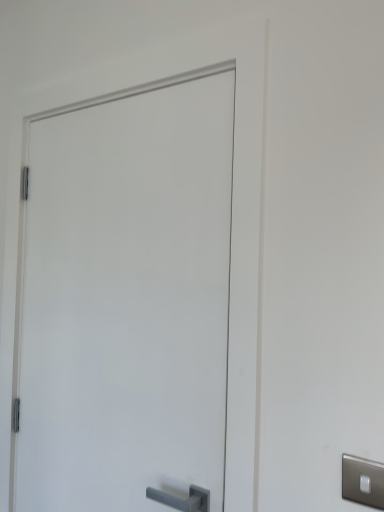
Based on the photo, what is the approximate height of satin nickel switch at lower right?

It is 3.79 inches.

Where is `satin nickel switch at lower right`? This screenshot has width=384, height=512. satin nickel switch at lower right is located at coordinates (363, 481).

What do you see at coordinates (363, 481) in the screenshot?
I see `satin nickel switch at lower right` at bounding box center [363, 481].

This screenshot has width=384, height=512. In order to click on white matte door at center in this screenshot , I will do `click(127, 300)`.

The width and height of the screenshot is (384, 512). What do you see at coordinates (127, 300) in the screenshot?
I see `white matte door at center` at bounding box center [127, 300].

Find the location of a particular element. Image resolution: width=384 pixels, height=512 pixels. satin nickel switch at lower right is located at coordinates (363, 481).

Considering the relative positions of white matte door at center and satin nickel switch at lower right in the image provided, is white matte door at center to the left of satin nickel switch at lower right from the viewer's perspective?

Yes, white matte door at center is to the left of satin nickel switch at lower right.

Is white matte door at center positioned in front of satin nickel switch at lower right?

No, the depth of white matte door at center is greater than that of satin nickel switch at lower right.

Which point is more distant from viewer, (29, 159) or (381, 489)?

Point (29, 159)

From the image's perspective, between white matte door at center and satin nickel switch at lower right, which one is located above?

white matte door at center, from the image's perspective.

From a real-world perspective, who is located higher, white matte door at center or satin nickel switch at lower right?

In real-world perspective, white matte door at center is above.

Considering the relative sizes of white matte door at center and satin nickel switch at lower right in the image provided, is white matte door at center thinner than satin nickel switch at lower right?

No.

In the scene shown: In terms of height, does white matte door at center look taller or shorter compared to satin nickel switch at lower right?

Clearly, white matte door at center is taller compared to satin nickel switch at lower right.

Is white matte door at center bigger than satin nickel switch at lower right?

Yes.

Is white matte door at center inside or outside of satin nickel switch at lower right?

white matte door at center is not inside satin nickel switch at lower right, it's outside.

Are white matte door at center and satin nickel switch at lower right making contact?

There is a gap between white matte door at center and satin nickel switch at lower right.

Is white matte door at center looking in the opposite direction of satin nickel switch at lower right?

No.

What's the angular difference between white matte door at center and satin nickel switch at lower right's facing directions?

0.283 degrees.

The width and height of the screenshot is (384, 512). I want to click on light switch below the white matte door at center (from a real-world perspective), so click(363, 481).

Which is more to the left, satin nickel switch at lower right or white matte door at center?

white matte door at center is more to the left.

Is satin nickel switch at lower right positioned before white matte door at center?

Yes, satin nickel switch at lower right is in front of white matte door at center.

Does point (352, 486) come closer to viewer compared to point (120, 196)?

Yes, point (352, 486) is in front of point (120, 196).

From the image's perspective, is satin nickel switch at lower right above or below white matte door at center?

From the image's perspective, satin nickel switch at lower right appears below white matte door at center.

From a real-world perspective, is satin nickel switch at lower right positioned above or below white matte door at center?

satin nickel switch at lower right is situated lower than white matte door at center in the real world.

Between satin nickel switch at lower right and white matte door at center, which one has smaller width?

satin nickel switch at lower right.

Considering the relative sizes of satin nickel switch at lower right and white matte door at center in the image provided, is satin nickel switch at lower right taller than white matte door at center?

No, satin nickel switch at lower right is not taller than white matte door at center.

Between satin nickel switch at lower right and white matte door at center, which one has larger size?

With larger size is white matte door at center.

Is white matte door at center located within satin nickel switch at lower right?

Actually, white matte door at center is outside satin nickel switch at lower right.

Are satin nickel switch at lower right and white matte door at center located far from each other?

Actually, satin nickel switch at lower right and white matte door at center are a little close together.

Is white matte door at center at the back of satin nickel switch at lower right?

That's not correct — satin nickel switch at lower right is not looking away from white matte door at center.

The image size is (384, 512). What are the coordinates of `door located above the satin nickel switch at lower right (from a real-world perspective)` in the screenshot? It's located at (127, 300).

Identify the location of door located above the satin nickel switch at lower right (from a real-world perspective). pos(127,300).

I want to click on door lying behind the satin nickel switch at lower right, so pos(127,300).